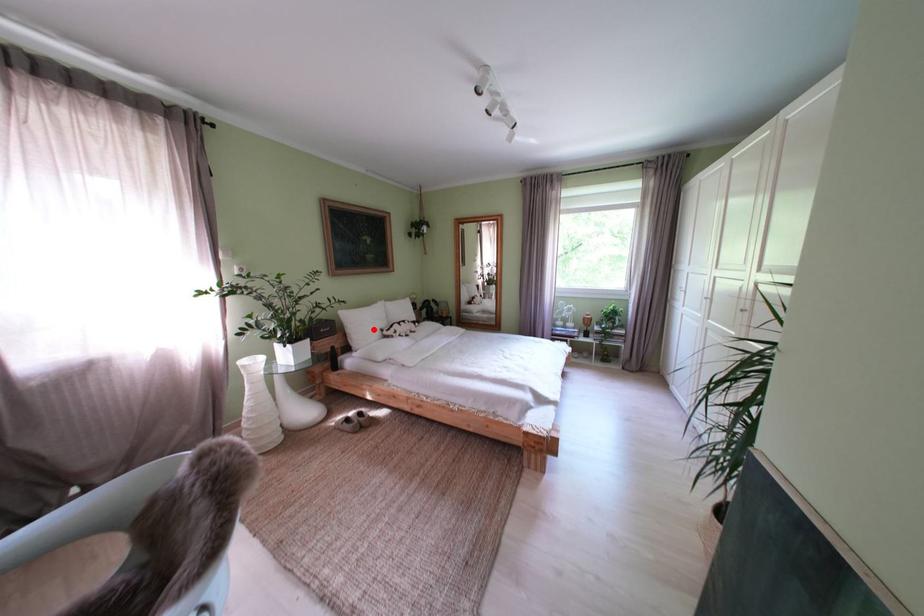
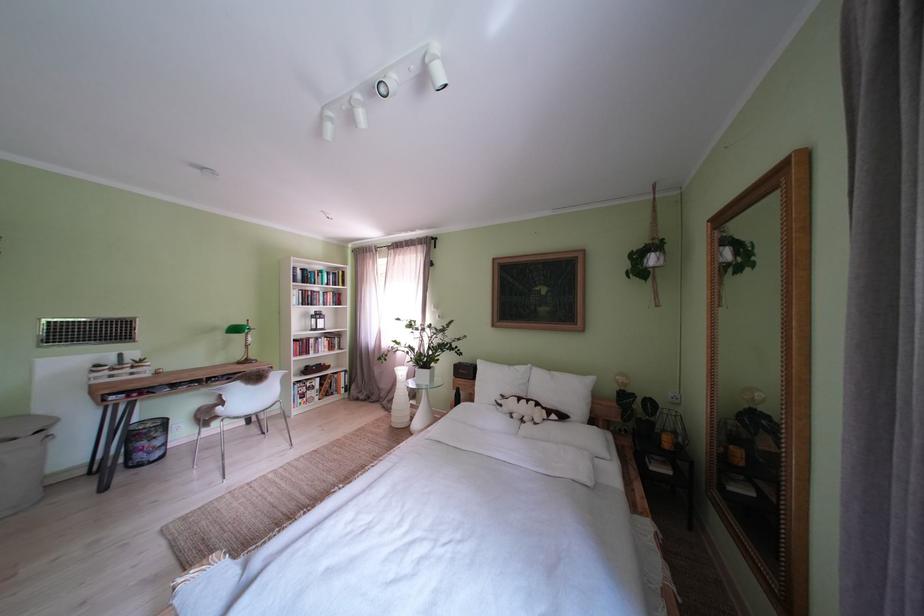
Question: I am providing you with two images of the same scene from different viewpoints. In image1, a red point is highlighted. Considering the same 3D point in image2, which of the following is correct?

Choices:
 (A) It is closer
 (B) It is farther

Answer: (B)